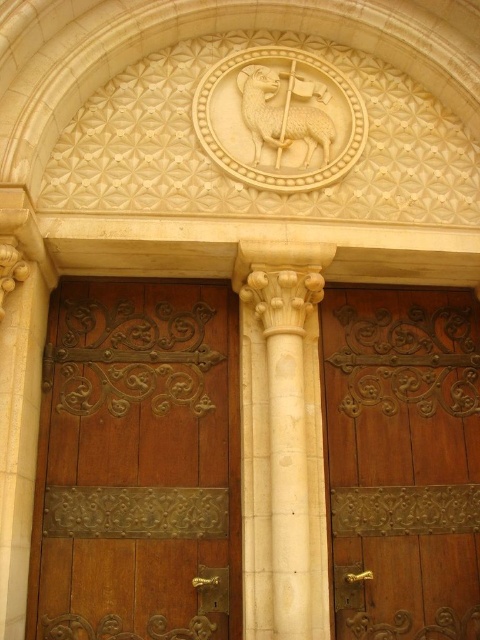
Between wooden door at center and brown wood door at center, which one appears on the left side from the viewer's perspective?

wooden door at center is more to the left.

Can you confirm if wooden door at center is thinner than brown wood door at center?

No.

Identify the location of wooden door at center. This screenshot has width=480, height=640. (137, 464).

Can you confirm if brown wood door at center is positioned below white stone column at center?

Yes.

Which of these two, brown wood door at center or white stone column at center, stands shorter?

brown wood door at center is shorter.

Measure the distance between brown wood door at center and camera.

The distance of brown wood door at center from camera is 10.63 meters.

Where is `brown wood door at center`? This screenshot has height=640, width=480. brown wood door at center is located at coordinates (403, 460).

Image resolution: width=480 pixels, height=640 pixels. What do you see at coordinates (137, 464) in the screenshot? I see `wooden door at center` at bounding box center [137, 464].

Can you confirm if wooden door at center is positioned below white stone column at center?

Yes.

Who is more forward, (97,449) or (278,273)?

Point (278,273)

Identify the location of wooden door at center. This screenshot has height=640, width=480. (137, 464).